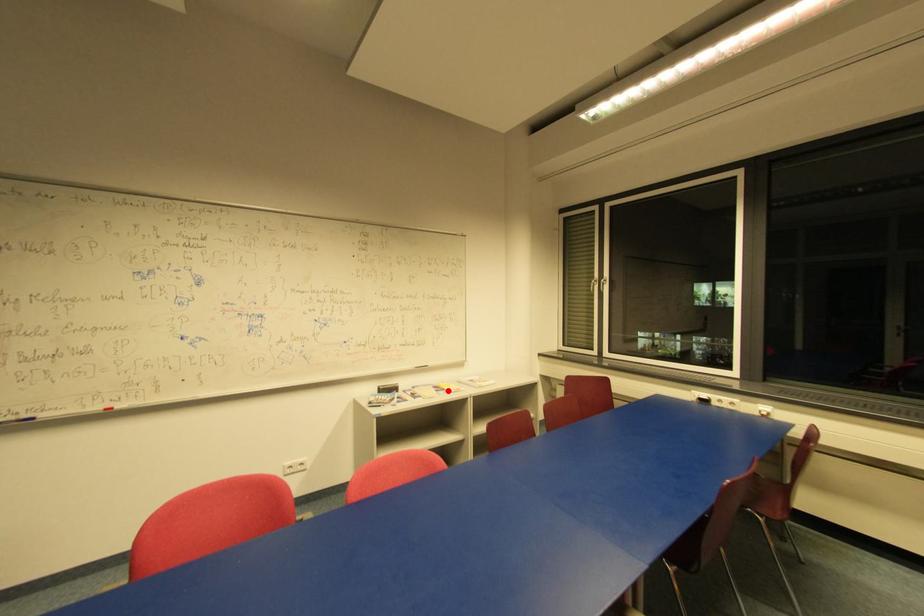
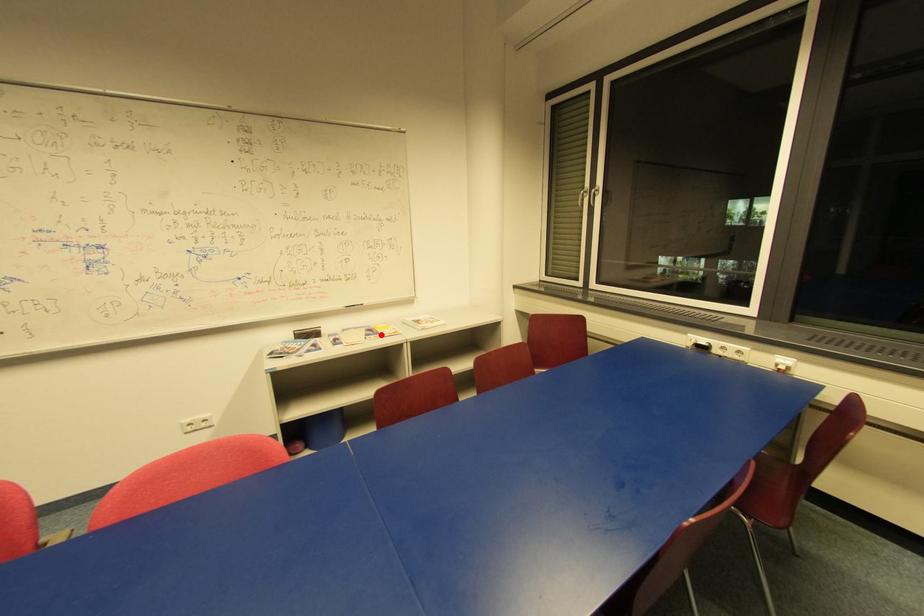
I am providing you with two images of the same scene from different viewpoints. A red point is marked on the first image and another point is marked on the second image. Is the marked point in image1 the same physical position as the marked point in image2?

Yes